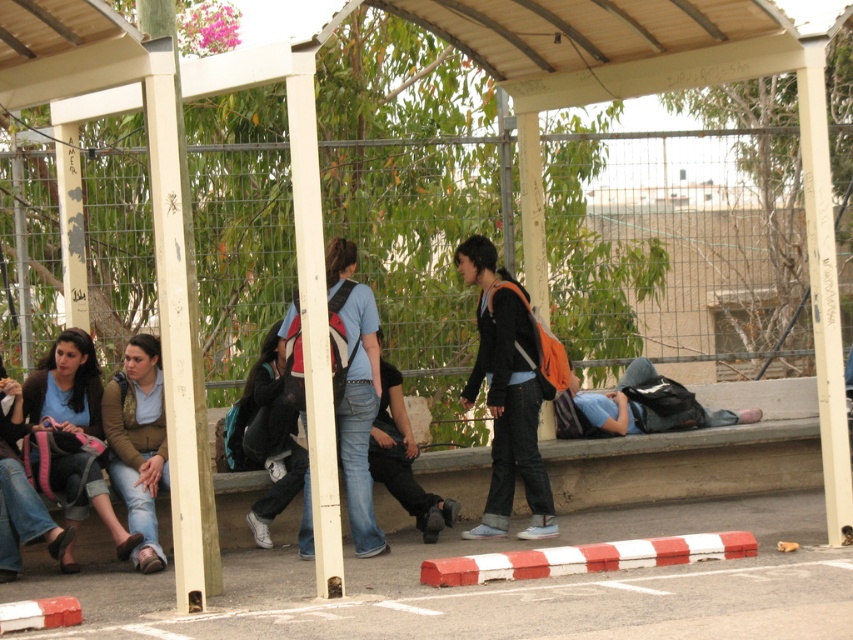
Does point (346, 209) lie in front of point (526, 392)?

No.

Image resolution: width=853 pixels, height=640 pixels. In order to click on wire mesh fence at center in this screenshot , I will do `click(677, 248)`.

I want to click on wire mesh fence at center, so click(677, 248).

Does point (32, 520) come behind point (442, 522)?

No.

Describe the element at coordinates (20, 492) in the screenshot. I see `denim jacket at lower left` at that location.

This screenshot has width=853, height=640. In order to click on denim jacket at lower left in this screenshot , I will do `click(20, 492)`.

Measure the distance from red painted concrete curb at lower center to blue denim jeans at lower right.

A distance of 7.15 feet exists between red painted concrete curb at lower center and blue denim jeans at lower right.

Find the location of a particular element. This screenshot has height=640, width=853. red painted concrete curb at lower center is located at coordinates (585, 557).

Does point (625, 552) come behind point (576, 406)?

That is False.

Where is `red painted concrete curb at lower center`? Image resolution: width=853 pixels, height=640 pixels. red painted concrete curb at lower center is located at coordinates (585, 557).